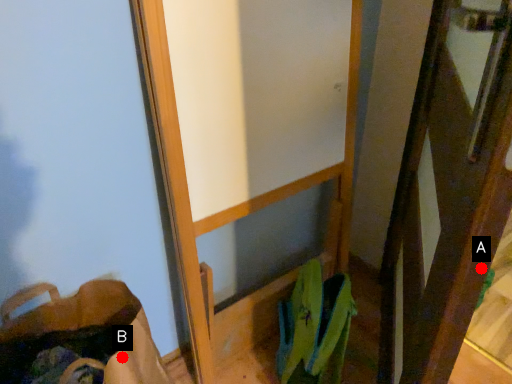
Question: Two points are circled on the image, labeled by A and B beside each circle. Which point is closer to the camera taking this photo?

Choices:
 (A) A is closer
 (B) B is closer

Answer: (A)